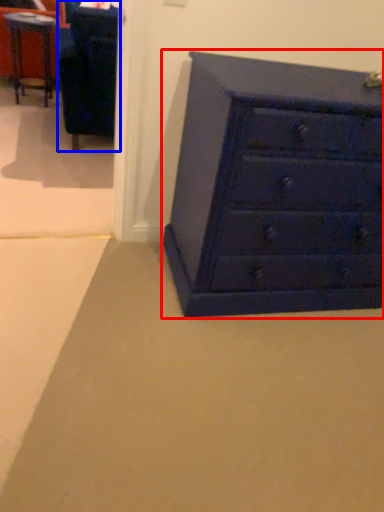
Question: Which point is further to the camera, chest of drawers (highlighted by a red box) or furniture (highlighted by a blue box)?

Choices:
 (A) chest of drawers
 (B) furniture

Answer: (B)